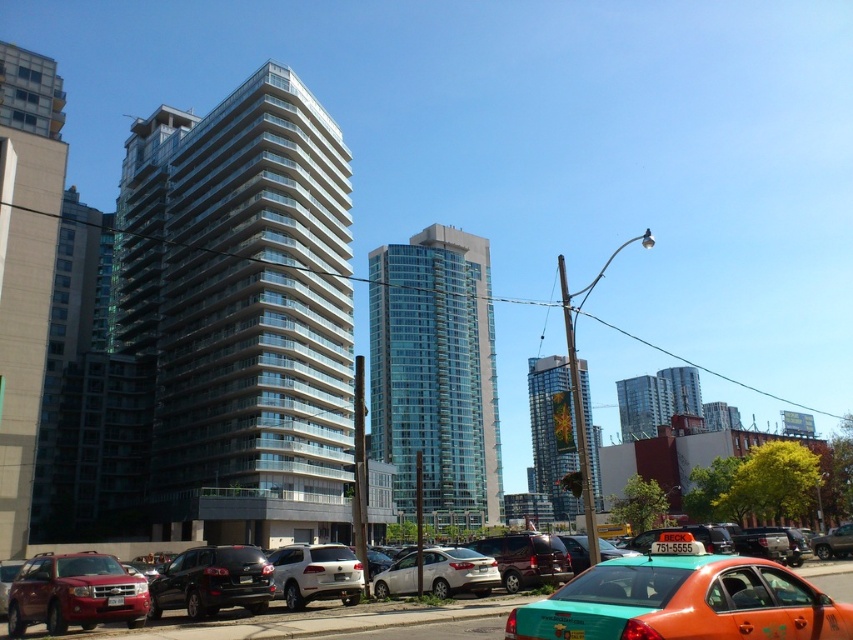
Between point (540, 438) and point (225, 560), which one is positioned behind?

Point (540, 438)

Is point (560, 442) farther from camera compared to point (229, 586)?

Yes, it is behind point (229, 586).

Is point (543, 381) positioned behind point (206, 568)?

Yes, it is behind point (206, 568).

Find the location of a particular element. This screenshot has height=640, width=853. glassy reflective skyscraper at center is located at coordinates (552, 433).

In the scene shown: Can you confirm if transparent glass building at center is smaller than shiny black suv at center?

No, transparent glass building at center is not smaller than shiny black suv at center.

Who is positioned more to the left, transparent glass building at center or shiny black suv at center?

Positioned to the left is shiny black suv at center.

Does point (427, 259) lie in front of point (212, 605)?

No, it is behind (212, 605).

Find the location of a particular element. transparent glass building at center is located at coordinates [434, 372].

Is transparent glass building at center smaller than matte red suv at lower left?

No, transparent glass building at center is not smaller than matte red suv at lower left.

Find the location of a particular element. This screenshot has width=853, height=640. transparent glass building at center is located at coordinates (434, 372).